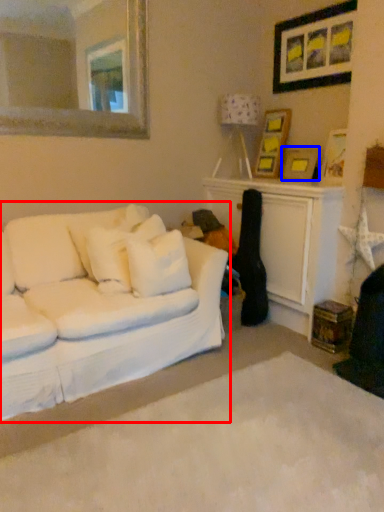
Question: Which object appears farthest to the camera in this image, studio couch (highlighted by a red box) or picture frame (highlighted by a blue box)?

Choices:
 (A) studio couch
 (B) picture frame

Answer: (B)